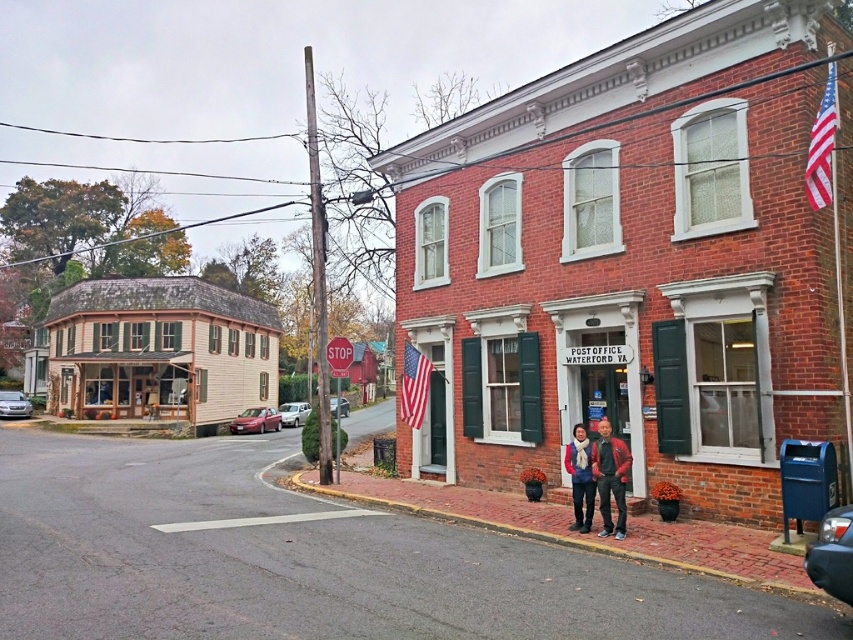
You are standing in front of the post office and want to take a photo of the light beige wood siding at left and the american flag at center. Which object is closer to you?

The light beige wood siding at left is closer to you than the american flag at center.